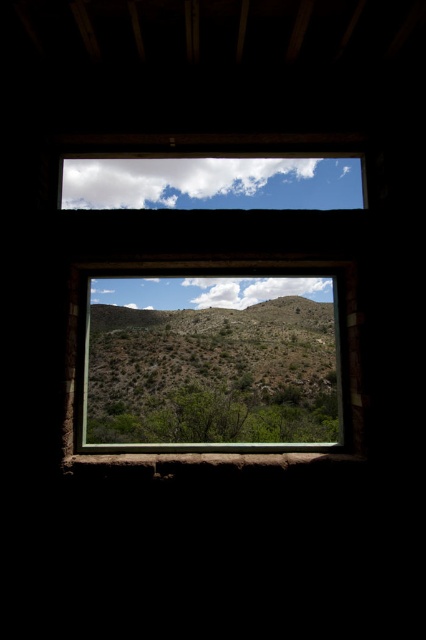
Question: Which object appears farthest from the camera in this image?

Choices:
 (A) green leafy tree at center
 (B) rustic wooden frame at center

Answer: (A)

Question: Which point is farther to the camera?

Choices:
 (A) (204, 396)
 (B) (121, 321)

Answer: (B)

Question: From the image, what is the correct spatial relationship of rustic wooden frame at center in relation to green leafy tree at center?

Choices:
 (A) right
 (B) left

Answer: (A)

Question: Can you confirm if rustic wooden frame at center is smaller than green leafy tree at center?

Choices:
 (A) yes
 (B) no

Answer: (B)

Question: Which of the following is the farthest from the observer?

Choices:
 (A) (175, 257)
 (B) (86, 433)

Answer: (B)

Question: Is rustic wooden frame at center further to camera compared to green leafy tree at center?

Choices:
 (A) no
 (B) yes

Answer: (A)